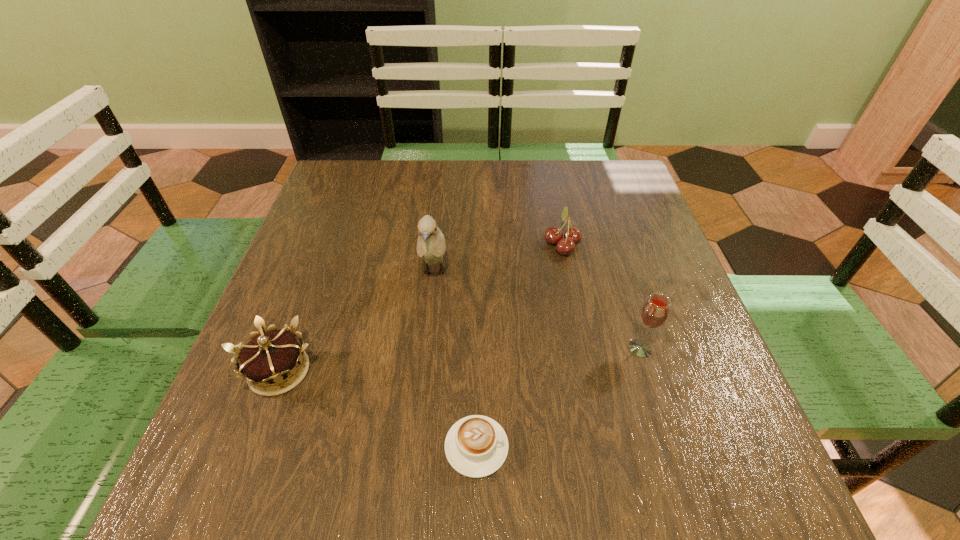
Identify the location of blank space at the left edge of the desktop. pos(330,242).

Image resolution: width=960 pixels, height=540 pixels. Identify the location of vacant space at the right edge of the desktop. (697, 425).

Find the location of a particular element. This screenshot has width=960, height=540. vacant point at the far left corner is located at coordinates (324, 191).

Image resolution: width=960 pixels, height=540 pixels. What are the coordinates of `vacant area at the near right corner` in the screenshot? It's located at (757, 463).

The image size is (960, 540). What are the coordinates of `vacant area that lies between the fourth object from left to right and the third object from right to left` in the screenshot? It's located at (519, 346).

You are a GUI agent. You are given a task and a screenshot of the screen. Output one action in this format:
    pyautogui.click(x=<x>, y=<y>)
    Task: Click on the free area in between the cherry and the fourth object from right to left
    This screenshot has height=540, width=960.
    Given the screenshot: What is the action you would take?
    pyautogui.click(x=498, y=259)

Image resolution: width=960 pixels, height=540 pixels. Find the location of `empty space between the shortest object and the cherry`. empty space between the shortest object and the cherry is located at coordinates (519, 346).

Where is `free space that is in between the cappuccino and the second object from right to left`? The height and width of the screenshot is (540, 960). free space that is in between the cappuccino and the second object from right to left is located at coordinates (519, 346).

This screenshot has width=960, height=540. In order to click on vacant area that lies between the fourth object from right to left and the third object from right to left in this screenshot , I will do `click(455, 360)`.

Find the location of a particular element. The width and height of the screenshot is (960, 540). empty space between the cherry and the shortest object is located at coordinates (519, 346).